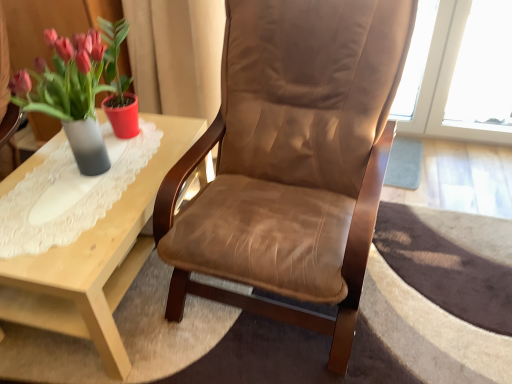
Identify the location of free space in front of matte gray vase at left. (64, 220).